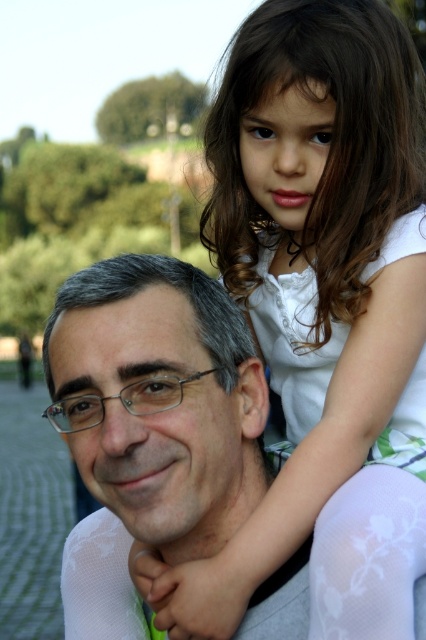
Does white cotton shirt at upper right come in front of matte gray shirt at center?

Yes, white cotton shirt at upper right is in front of matte gray shirt at center.

Locate an element on the screen. The width and height of the screenshot is (426, 640). white cotton shirt at upper right is located at coordinates (316, 294).